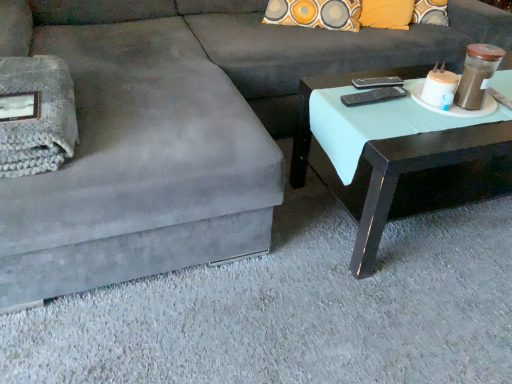
What is the approximate width of matte black coffee table at right?

matte black coffee table at right is 22.34 inches in width.

Locate an element on the screen. The image size is (512, 384). black plastic remote at upper right, which ranks as the 2th remote in top-to-bottom order is located at coordinates (374, 96).

Describe the element at coordinates (374, 96) in the screenshot. This screenshot has width=512, height=384. I see `black plastic remote at upper right, the 1th remote in the front-to-back sequence` at that location.

You are a GUI agent. You are given a task and a screenshot of the screen. Output one action in this format:
    pyautogui.click(x=<x>, y=<y>)
    Task: Click on the matte black coffee table at right
    The image size is (512, 384).
    Given the screenshot: What is the action you would take?
    pyautogui.click(x=404, y=168)

Does black plastic remote at upper right, the 1th remote from the bottom, appear on the right side of matte black coffee table at right?

Incorrect, black plastic remote at upper right, the 1th remote from the bottom, is not on the right side of matte black coffee table at right.

Which object is closer to the camera, black plastic remote at upper right, the 1th remote in the front-to-back sequence, or matte black coffee table at right?

Positioned in front is matte black coffee table at right.

Does black plastic remote at upper right, the 1th remote from the bottom, have a lesser height compared to matte black coffee table at right?

Yes, black plastic remote at upper right, the 1th remote from the bottom, is shorter than matte black coffee table at right.

Is black plastic remote at upper right, which is the second remote in front-to-back order, with matte black coffee table at right?

No, black plastic remote at upper right, which is the second remote in front-to-back order, is not touching matte black coffee table at right.

Could you tell me if black plastic remote at upper right, which is the second remote in front-to-back order, is turned towards matte black coffee table at right?

No, black plastic remote at upper right, which is the second remote in front-to-back order, does not turn towards matte black coffee table at right.

Looking at this image, from a real-world perspective, is black plastic remote at upper right, which is the second remote in front-to-back order, positioned above or below matte black coffee table at right?

black plastic remote at upper right, which is the second remote in front-to-back order, is above matte black coffee table at right.

In the scene shown: Is black plastic remote at upper right, which ranks as the 2th remote in top-to-bottom order, oriented towards black plastic remote at upper right, the first remote viewed from the back?

No, black plastic remote at upper right, which ranks as the 2th remote in top-to-bottom order, is not turned towards black plastic remote at upper right, the first remote viewed from the back.

Considering the sizes of objects black plastic remote at upper right, which ranks as the 2th remote in top-to-bottom order, and black plastic remote at upper right, which is the second remote in front-to-back order, in the image provided, who is wider, black plastic remote at upper right, which ranks as the 2th remote in top-to-bottom order, or black plastic remote at upper right, which is the second remote in front-to-back order,?

black plastic remote at upper right, which ranks as the 2th remote in top-to-bottom order, is wider.

Is point (397, 97) behind point (393, 82)?

That is False.

Based on their sizes in the image, would you say matte black coffee table at right is bigger or smaller than black plastic remote at upper right, which appears as the 2th remote when ordered from the bottom?

Considering their sizes, matte black coffee table at right takes up more space than black plastic remote at upper right, which appears as the 2th remote when ordered from the bottom.

Is matte black coffee table at right aimed at black plastic remote at upper right, which is the second remote in front-to-back order?

No, matte black coffee table at right is not aimed at black plastic remote at upper right, which is the second remote in front-to-back order.

Looking at their sizes, would you say matte black coffee table at right is wider or thinner than black plastic remote at upper right, marked as the first remote in a top-to-bottom arrangement?

Clearly, matte black coffee table at right has more width compared to black plastic remote at upper right, marked as the first remote in a top-to-bottom arrangement.

How different are the orientations of matte black coffee table at right and black plastic remote at upper right, marked as the first remote in a top-to-bottom arrangement, in degrees?

There is a 5.55-degree angle between the facing directions of matte black coffee table at right and black plastic remote at upper right, marked as the first remote in a top-to-bottom arrangement.

In terms of size, does matte black coffee table at right appear bigger or smaller than black plastic remote at upper right, the 1th remote from the bottom?

Considering their sizes, matte black coffee table at right takes up more space than black plastic remote at upper right, the 1th remote from the bottom.

Between point (389, 70) and point (360, 102), which one is positioned in front?

Point (360, 102)

Between matte black coffee table at right and black plastic remote at upper right, which ranks as the 2th remote in top-to-bottom order, which one has larger width?

matte black coffee table at right.

Considering the relative sizes of matte black coffee table at right and black plastic remote at upper right, which ranks as the 2th remote in top-to-bottom order, in the image provided, is matte black coffee table at right shorter than black plastic remote at upper right, which ranks as the 2th remote in top-to-bottom order,?

No, matte black coffee table at right is not shorter than black plastic remote at upper right, which ranks as the 2th remote in top-to-bottom order.

Considering the sizes of objects black plastic remote at upper right, the first remote viewed from the back, and black plastic remote at upper right, the 1th remote in the front-to-back sequence, in the image provided, who is taller, black plastic remote at upper right, the first remote viewed from the back, or black plastic remote at upper right, the 1th remote in the front-to-back sequence,?

Standing taller between the two is black plastic remote at upper right, the 1th remote in the front-to-back sequence.

Based on the photo, from the image's perspective, which object appears higher, black plastic remote at upper right, the first remote viewed from the back, or black plastic remote at upper right, the 1th remote from the bottom?

black plastic remote at upper right, the first remote viewed from the back.

Is black plastic remote at upper right, which appears as the 2th remote when ordered from the bottom, positioned with its back to black plastic remote at upper right, which ranks as the 2th remote in top-to-bottom order?

No, black plastic remote at upper right, which appears as the 2th remote when ordered from the bottom, is not facing the opposite direction of black plastic remote at upper right, which ranks as the 2th remote in top-to-bottom order.

Is black plastic remote at upper right, the first remote viewed from the back, inside the boundaries of black plastic remote at upper right, the 1th remote from the bottom, or outside?

black plastic remote at upper right, the first remote viewed from the back, is outside black plastic remote at upper right, the 1th remote from the bottom.

Where is `coffee table on the right of black plastic remote at upper right, which ranks as the 2th remote in top-to-bottom order`? The width and height of the screenshot is (512, 384). coffee table on the right of black plastic remote at upper right, which ranks as the 2th remote in top-to-bottom order is located at coordinates (404, 168).

From the image's perspective, starting from the matte black coffee table at right, which remote is the 2nd one above? Please provide its 2D coordinates.

[(377, 82)]

When comparing their distances from black plastic remote at upper right, the 1th remote in the front-to-back sequence, does matte black coffee table at right or black plastic remote at upper right, which is the second remote in front-to-back order, seem closer?

Based on the image, black plastic remote at upper right, which is the second remote in front-to-back order, appears to be nearer to black plastic remote at upper right, the 1th remote in the front-to-back sequence.

Considering their positions, is black plastic remote at upper right, the 2th remote viewed from the back, positioned further to matte black coffee table at right than black plastic remote at upper right, which appears as the 2th remote when ordered from the bottom?

black plastic remote at upper right, which appears as the 2th remote when ordered from the bottom, is positioned further to the anchor matte black coffee table at right.

Considering their positions, is black plastic remote at upper right, which is the second remote in front-to-back order, positioned closer to black plastic remote at upper right, the 2th remote viewed from the back, than matte black coffee table at right?

black plastic remote at upper right, which is the second remote in front-to-back order, lies closer to black plastic remote at upper right, the 2th remote viewed from the back, than the other object.

Which object lies nearer to the anchor point matte black coffee table at right, black plastic remote at upper right, which appears as the 2th remote when ordered from the bottom, or black plastic remote at upper right, the 1th remote from the bottom?

Among the two, black plastic remote at upper right, the 1th remote from the bottom, is located nearer to matte black coffee table at right.

Based on the photo, which object lies nearer to the anchor point black plastic remote at upper right, which appears as the 2th remote when ordered from the bottom, matte black coffee table at right or black plastic remote at upper right, which ranks as the 2th remote in top-to-bottom order?

Among the two, black plastic remote at upper right, which ranks as the 2th remote in top-to-bottom order, is located nearer to black plastic remote at upper right, which appears as the 2th remote when ordered from the bottom.

When comparing their distances from black plastic remote at upper right, the first remote viewed from the back, does black plastic remote at upper right, which ranks as the 2th remote in top-to-bottom order, or matte black coffee table at right seem further?

Based on the image, matte black coffee table at right appears to be further to black plastic remote at upper right, the first remote viewed from the back.

You are a GUI agent. You are given a task and a screenshot of the screen. Output one action in this format:
    pyautogui.click(x=<x>, y=<y>)
    Task: Click on the remote between matte black coffee table at right and black plastic remote at upper right, which appears as the 2th remote when ordered from the bottom, from front to back
    The height and width of the screenshot is (384, 512).
    Given the screenshot: What is the action you would take?
    pyautogui.click(x=374, y=96)